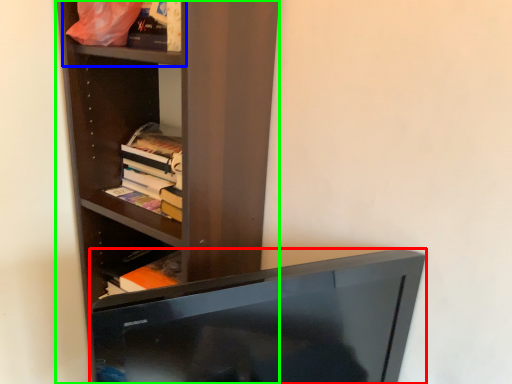
Question: Estimate the real-world distances between objects in this image. Which object is closer to television (highlighted by a red box), cabinet (highlighted by a blue box) or shelf (highlighted by a green box)?

Choices:
 (A) cabinet
 (B) shelf

Answer: (B)